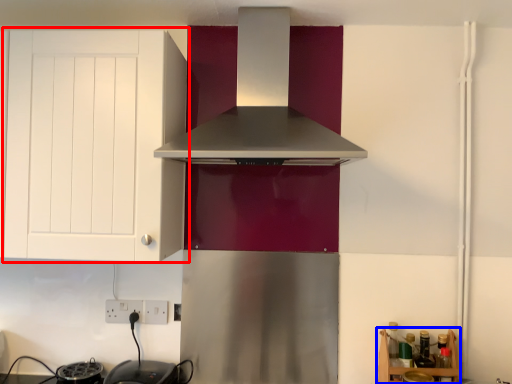
Question: Which object appears closest to the camera in this image, cabinetry (highlighted by a red box) or shelf (highlighted by a blue box)?

Choices:
 (A) cabinetry
 (B) shelf

Answer: (A)